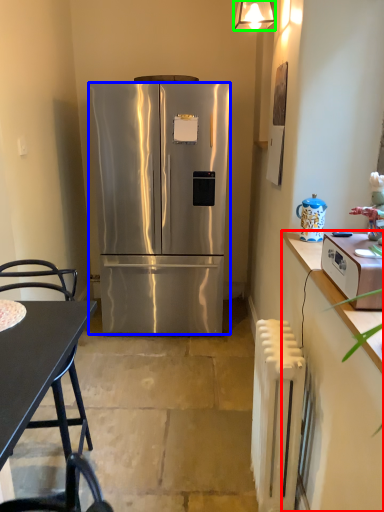
Question: Which object is the farthest from cabinetry (highlighted by a red box)? Choose among these: refrigerator (highlighted by a blue box) or lamp (highlighted by a green box).

Choices:
 (A) refrigerator
 (B) lamp

Answer: (B)